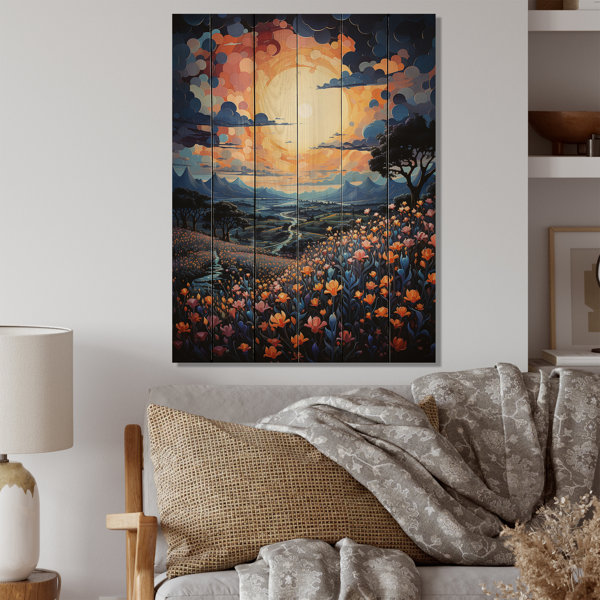
You are a GUI agent. You are given a task and a screenshot of the screen. Output one action in this format:
    pyautogui.click(x=<x>, y=<y>)
    Task: Click on the sun in painting
    
    Given the screenshot: What is the action you would take?
    pyautogui.click(x=300, y=111)